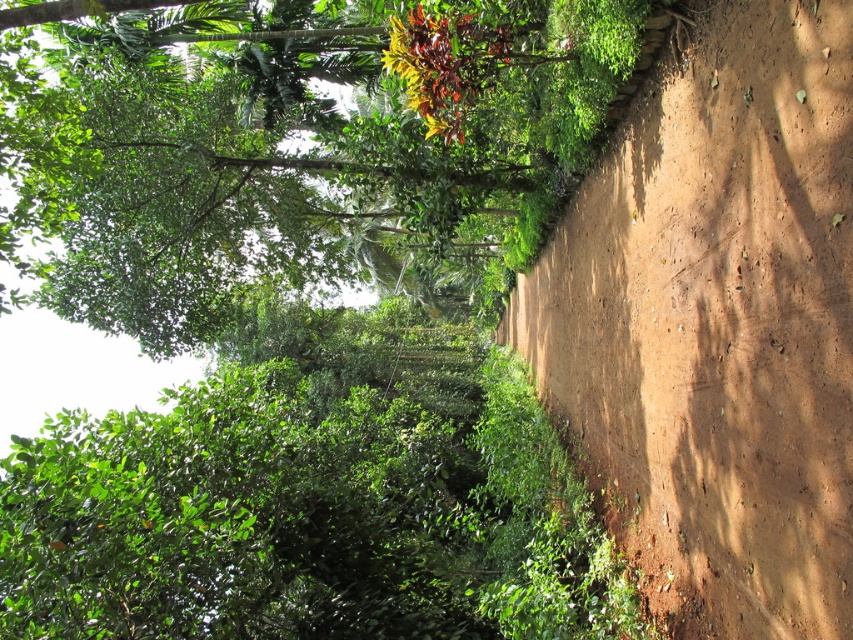
Question: Which object appears farthest from the camera in this image?

Choices:
 (A) green leafy bush at center
 (B) green leafy tree at center

Answer: (B)

Question: Can you confirm if green leafy bush at center is bigger than green leafy tree at center?

Choices:
 (A) yes
 (B) no

Answer: (B)

Question: Is green leafy bush at center above green leafy tree at center?

Choices:
 (A) no
 (B) yes

Answer: (A)

Question: Which object is closer to the camera taking this photo?

Choices:
 (A) green leafy bush at center
 (B) green leafy tree at center

Answer: (A)

Question: Does green leafy bush at center have a smaller size compared to green leafy tree at center?

Choices:
 (A) no
 (B) yes

Answer: (B)

Question: Which point is farther to the camera?

Choices:
 (A) green leafy bush at center
 (B) green leafy tree at center

Answer: (B)